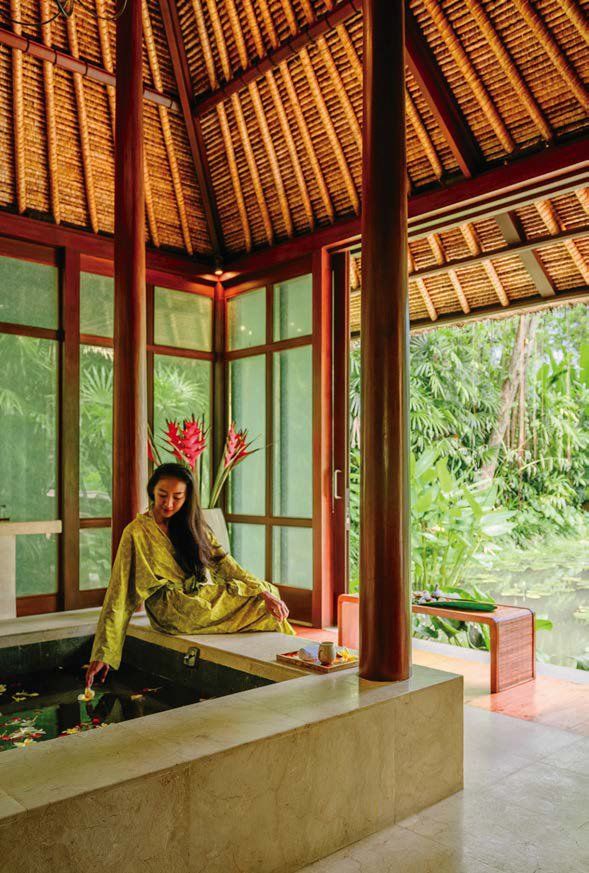
Where is `cup`? This screenshot has height=873, width=589. cup is located at coordinates (329, 656).